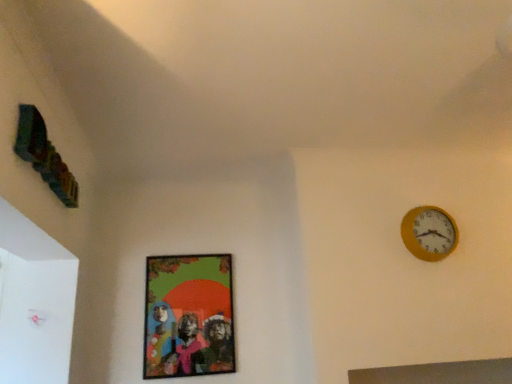
What do you see at coordinates (188, 316) in the screenshot?
I see `matte plastic picture frame at center` at bounding box center [188, 316].

Measure the distance between point (168, 376) and camera.

They are 9.51 feet apart.

Identify the location of matte plastic picture frame at center. This screenshot has height=384, width=512. (188, 316).

In order to face yellow wooden clock at upper right, should I rotate leftwards or rightwards?

Rotate your view right by about 22.608°.

At what (x,y) coordinates should I click in order to perform the action: click on yellow wooden clock at upper right. Please return your answer as a coordinate pair (x, y). Looking at the image, I should click on (429, 233).

This screenshot has width=512, height=384. Describe the element at coordinates (429, 233) in the screenshot. I see `yellow wooden clock at upper right` at that location.

Where is `matte plastic picture frame at center`? Image resolution: width=512 pixels, height=384 pixels. matte plastic picture frame at center is located at coordinates (188, 316).

Which object is positioned more to the left, matte plastic picture frame at center or yellow wooden clock at upper right?

matte plastic picture frame at center.

Which object is closer to the camera, matte plastic picture frame at center or yellow wooden clock at upper right?

yellow wooden clock at upper right is in front.

Is point (172, 328) closer or farther from the camera than point (409, 211)?

Clearly, point (172, 328) is more distant from the camera than point (409, 211).

From the image's perspective, which is below, matte plastic picture frame at center or yellow wooden clock at upper right?

From the image's view, matte plastic picture frame at center is below.

From a real-world perspective, is matte plastic picture frame at center on yellow wooden clock at upper right?

No, from a real-world perspective, matte plastic picture frame at center is not over yellow wooden clock at upper right

In terms of width, does matte plastic picture frame at center look wider or thinner when compared to yellow wooden clock at upper right?

Considering their sizes, matte plastic picture frame at center looks slimmer than yellow wooden clock at upper right.

Does matte plastic picture frame at center have a lesser height compared to yellow wooden clock at upper right?

Incorrect, the height of matte plastic picture frame at center does not fall short of that of yellow wooden clock at upper right.

Looking at the image, does matte plastic picture frame at center seem bigger or smaller compared to yellow wooden clock at upper right?

matte plastic picture frame at center is bigger than yellow wooden clock at upper right.

Is yellow wooden clock at upper right inside matte plastic picture frame at center?

No, yellow wooden clock at upper right is not surrounded by matte plastic picture frame at center.

Would you consider matte plastic picture frame at center to be distant from yellow wooden clock at upper right?

Yes.

Could you tell me if matte plastic picture frame at center is facing yellow wooden clock at upper right?

No, matte plastic picture frame at center is not facing towards yellow wooden clock at upper right.

Where is `picture frame lying below the yellow wooden clock at upper right (from the image's perspective)`? picture frame lying below the yellow wooden clock at upper right (from the image's perspective) is located at coordinates coord(188,316).

Is yellow wooden clock at upper right to the left or to the right of matte plastic picture frame at center in the image?

From the image, it's evident that yellow wooden clock at upper right is to the right of matte plastic picture frame at center.

Looking at this image, is yellow wooden clock at upper right closer to camera compared to matte plastic picture frame at center?

Yes, yellow wooden clock at upper right is closer to the viewer.

Which is more distant, (457, 231) or (159, 286)?

Positioned behind is point (159, 286).

From the image's perspective, is yellow wooden clock at upper right above or below matte plastic picture frame at center?

From the image's perspective, yellow wooden clock at upper right appears above matte plastic picture frame at center.

From a real-world perspective, which object stands above the other?

yellow wooden clock at upper right, from a real-world perspective.

Between yellow wooden clock at upper right and matte plastic picture frame at center, which one has smaller width?

matte plastic picture frame at center.

Does yellow wooden clock at upper right have a greater height compared to matte plastic picture frame at center?

Incorrect, the height of yellow wooden clock at upper right is not larger of that of matte plastic picture frame at center.

Considering the sizes of yellow wooden clock at upper right and matte plastic picture frame at center in the image, is yellow wooden clock at upper right bigger or smaller than matte plastic picture frame at center?

In the image, yellow wooden clock at upper right appears to be smaller than matte plastic picture frame at center.

Is yellow wooden clock at upper right outside of matte plastic picture frame at center?

Indeed, yellow wooden clock at upper right is completely outside matte plastic picture frame at center.

Would you say yellow wooden clock at upper right is a long distance from matte plastic picture frame at center?

Yes, yellow wooden clock at upper right and matte plastic picture frame at center are located far from each other.

In the scene shown: Could you tell me if yellow wooden clock at upper right is facing matte plastic picture frame at center?

No, yellow wooden clock at upper right is not turned towards matte plastic picture frame at center.

Can you tell me how much yellow wooden clock at upper right and matte plastic picture frame at center differ in facing direction?

The angular difference between yellow wooden clock at upper right and matte plastic picture frame at center is 0.00176 degrees.

The height and width of the screenshot is (384, 512). I want to click on picture frame that appears below the yellow wooden clock at upper right (from a real-world perspective), so click(188, 316).

There is a matte plastic picture frame at center. At what (x,y) coordinates should I click in order to perform the action: click on wall clock above it (from a real-world perspective). Please return your answer as a coordinate pair (x, y). Image resolution: width=512 pixels, height=384 pixels. Looking at the image, I should click on (429, 233).

At what (x,y) coordinates should I click in order to perform the action: click on wall clock in front of the matte plastic picture frame at center. Please return your answer as a coordinate pair (x, y). The image size is (512, 384). Looking at the image, I should click on (429, 233).